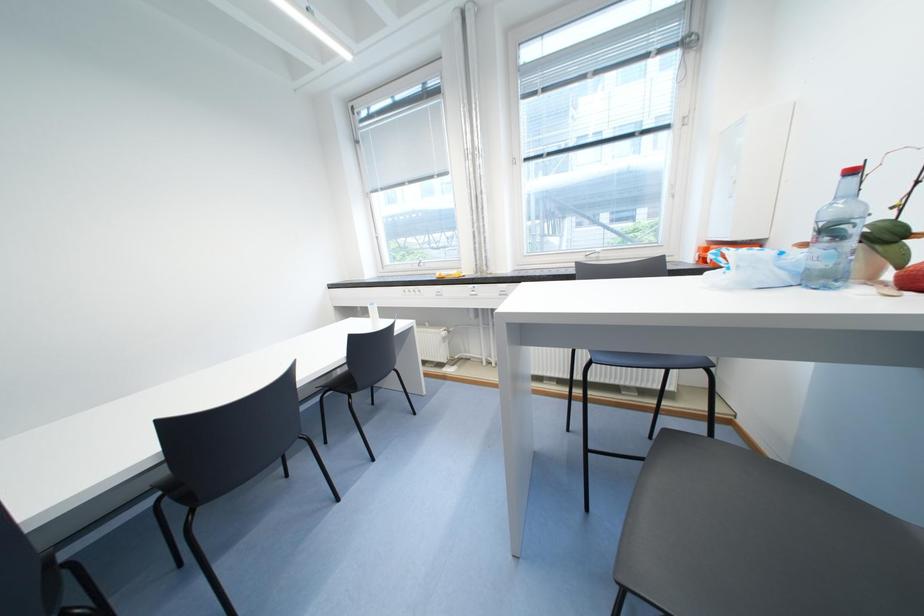
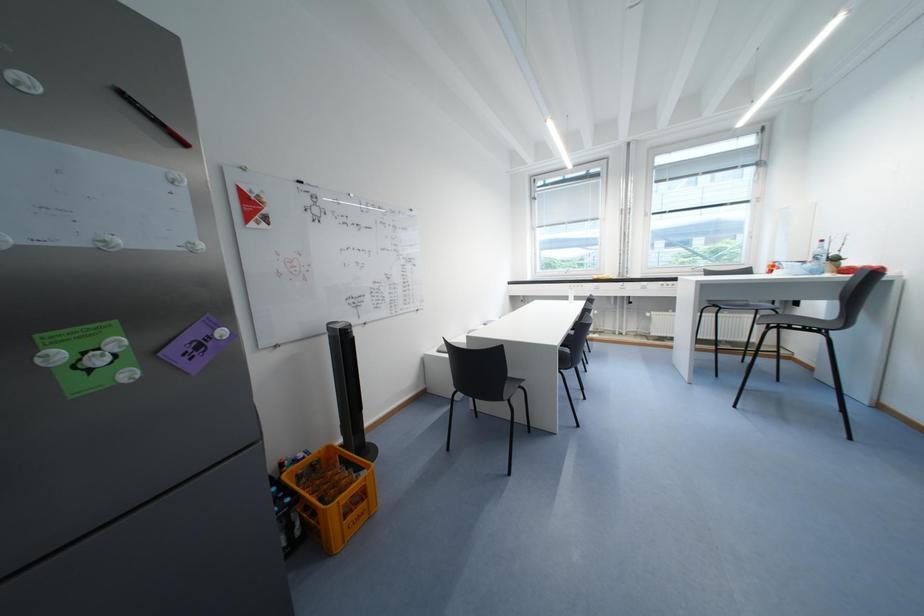
What movement of the cameraman would produce the second image?

The cameraman walked toward left, backward.